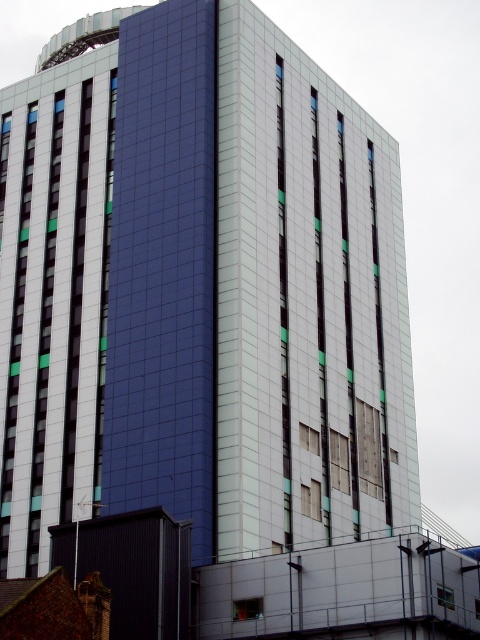
Question: Which object is closer to the camera taking this photo?

Choices:
 (A) transparent glass window at center
 (B) transparent glass window at lower right
 (C) clear glass window at center

Answer: (B)

Question: Can you confirm if transparent glass window at center is positioned to the left of transparent glass window at lower right?

Choices:
 (A) yes
 (B) no

Answer: (A)

Question: Is transparent glass window at center positioned behind clear glass window at center?

Choices:
 (A) no
 (B) yes

Answer: (A)

Question: Which object appears closest to the camera in this image?

Choices:
 (A) transparent glass window at center
 (B) transparent glass window at lower right
 (C) clear glass window at center

Answer: (B)

Question: Which object is closer to the camera taking this photo?

Choices:
 (A) transparent glass window at center
 (B) transparent glass window at lower right

Answer: (B)

Question: Is the position of clear glass window at center more distant than that of transparent glass window at lower right?

Choices:
 (A) no
 (B) yes

Answer: (B)